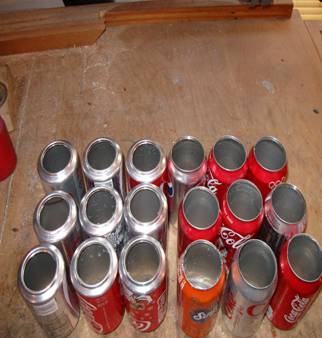
Locate an element on the screen. floor is located at coordinates (153, 77).